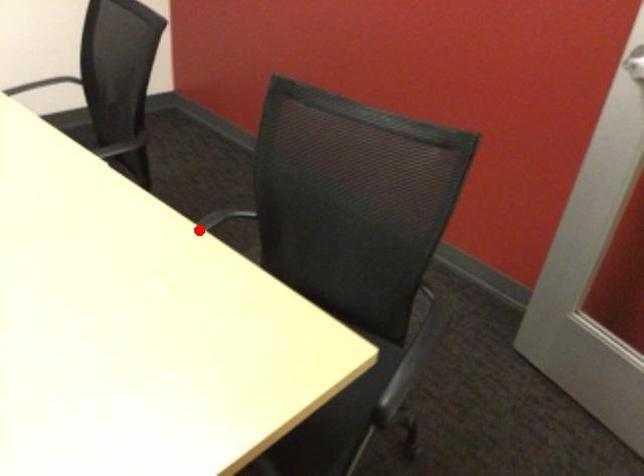
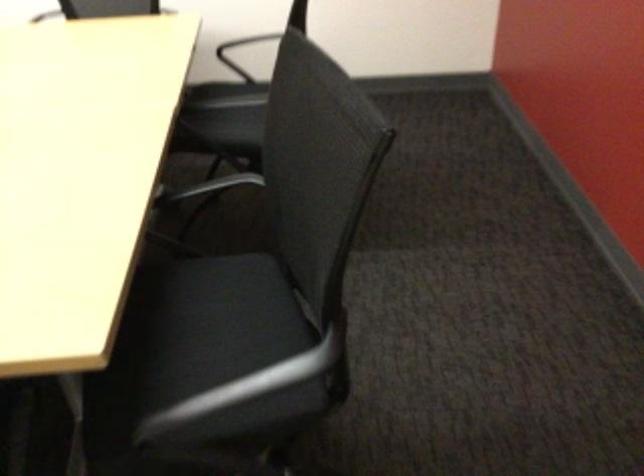
Question: I am providing you with two images of the same scene from different viewpoints. In image1, a red point is highlighted. Considering the same 3D point in image2, which of the following is correct?

Choices:
 (A) It is closer
 (B) It is farther

Answer: (B)